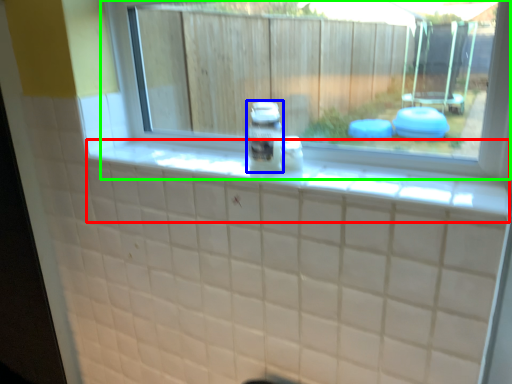
Question: Which object is positioned closest to ledge (highlighted by a red box)? Select from glass jar (highlighted by a blue box) and window (highlighted by a green box).

Choices:
 (A) glass jar
 (B) window

Answer: (A)